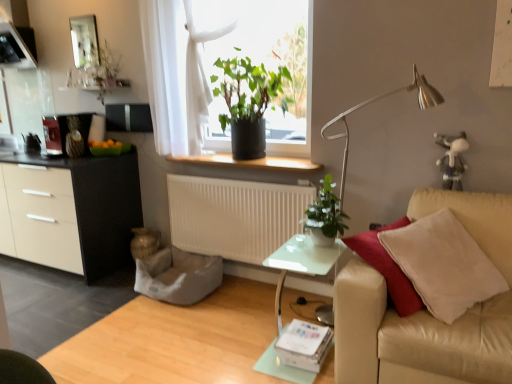
At what (x,y) coordinates should I click in order to perform the action: click on free point above white matte radiator at center (from a real-world perspective). Please return your answer as a coordinate pair (x, y). Image resolution: width=512 pixels, height=384 pixels. Looking at the image, I should click on (216, 173).